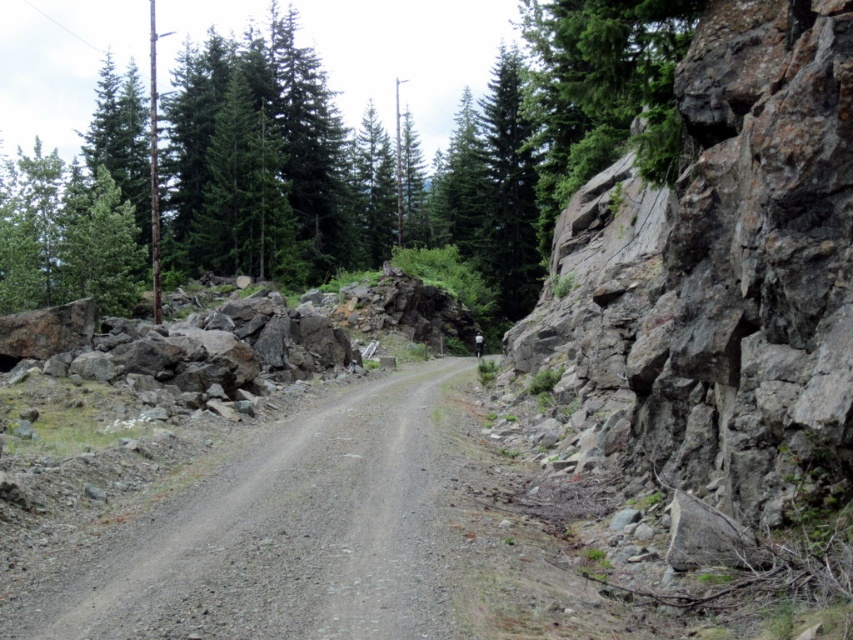
Can you confirm if green textured rock at upper right is bigger than dirt/gravel mountain path at center?

Yes.

Is point (514, 289) behind point (309, 467)?

Yes.

You are a GUI agent. You are given a task and a screenshot of the screen. Output one action in this format:
    pyautogui.click(x=<x>, y=<y>)
    Task: Click on the green textured rock at upper right
    
    Given the screenshot: What is the action you would take?
    pyautogui.click(x=337, y=163)